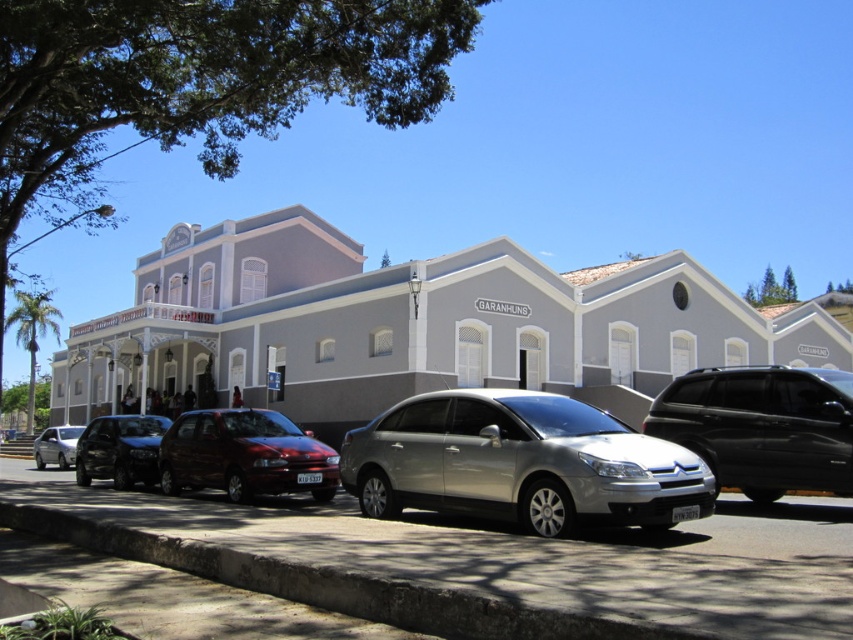
You are standing at the center of the street and want to locate the shiny black suv at left. Which direction should you look to find it?

You should look to the left to find the shiny black suv at left since it is located at point (120, 449), which is on the left side of the image.

You are standing on the street looking at the BARANHUNS building. There are two points marked on the image. The first point is at coordinate (100, 458) and the second is at (56, 445). Which point is physically closer to you as you stand in front of the building?

Point (100, 458) is closer to the viewer than point (56, 445).